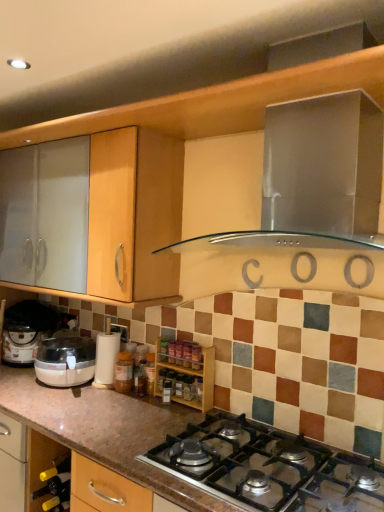
Question: Considering their positions, is white plastic coffee machine at lower left located in front of or behind translucent glass spice at center, arranged as the 2th bottle when viewed from the left?

Choices:
 (A) behind
 (B) front

Answer: (A)

Question: Considering the positions of white plastic coffee machine at lower left and translucent glass spice at center, which is the 1th bottle in front-to-back order, in the image, is white plastic coffee machine at lower left wider or thinner than translucent glass spice at center, which is the 1th bottle in front-to-back order,?

Choices:
 (A) thin
 (B) wide

Answer: (B)

Question: Which object is positioned farthest from the white plastic coffee machine at lower left?

Choices:
 (A) green glass wine bottle at lower left
 (B) wooden spice rack at center
 (C) translucent plastic bottle at center, which is the 2th bottle from right to left
 (D) translucent glass spice at center, which is the 1th bottle in front-to-back order
 (E) metallic silver gas stove at center

Answer: (E)

Question: Considering the real-world distances, which object is closest to the wooden spice rack at center?

Choices:
 (A) metallic silver gas stove at center
 (B) stainless steel range hood at upper center
 (C) translucent plastic bottle at center, positioned as the 1th bottle in left-to-right order
 (D) white plastic coffee machine at lower left
 (E) green glass wine bottle at lower left

Answer: (C)